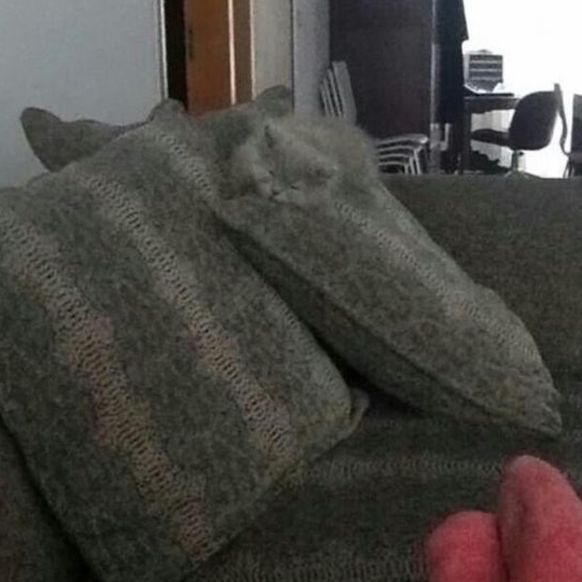
Where is `desk`? The height and width of the screenshot is (582, 582). desk is located at coordinates (x=501, y=95).